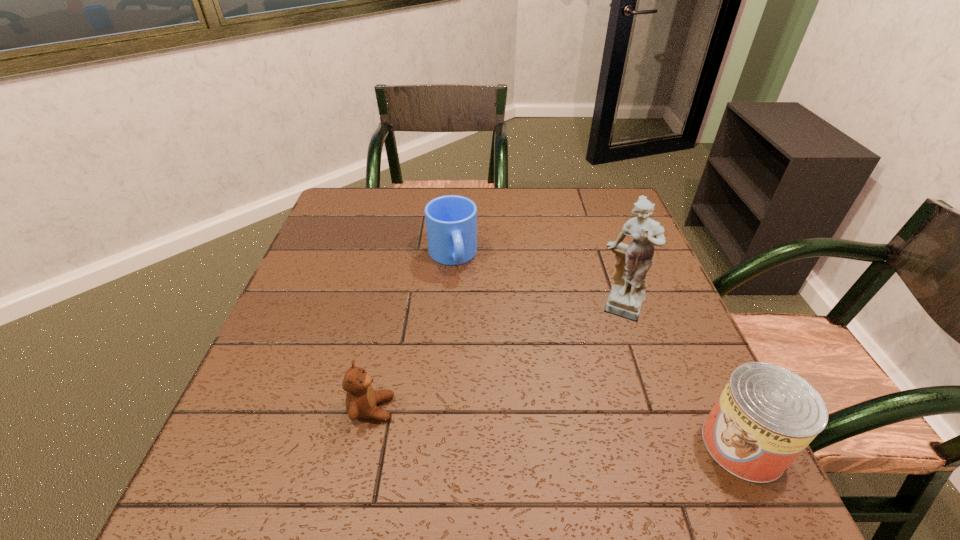
This screenshot has height=540, width=960. I want to click on vacant region located 0.290m on the front-facing side of the third object from left to right, so click(x=598, y=443).

Find the location of a particular element. vacant region located 0.180m on the side of the farthest object with the handle is located at coordinates (474, 329).

Where is `vacant area situated 0.250m on the side of the farthest object with the handle`? Image resolution: width=960 pixels, height=540 pixels. vacant area situated 0.250m on the side of the farthest object with the handle is located at coordinates (482, 353).

Locate an element on the screen. The height and width of the screenshot is (540, 960). vacant position located 0.060m on the side of the farthest object with the handle is located at coordinates (463, 293).

Locate an element on the screen. teddy bear located in the near edge section of the desktop is located at coordinates (361, 399).

The image size is (960, 540). In order to click on can that is at the near edge in this screenshot , I will do `click(766, 415)`.

You are a GUI agent. You are given a task and a screenshot of the screen. Output one action in this format:
    pyautogui.click(x=<x>, y=<y>)
    Task: Click on the can positioned at the right edge
    Image resolution: width=960 pixels, height=540 pixels.
    Given the screenshot: What is the action you would take?
    pyautogui.click(x=766, y=415)

Find the location of a particular element. This screenshot has width=960, height=540. figurine situated at the right edge is located at coordinates coord(633,261).

Where is `object located in the near right corner section of the desktop`? object located in the near right corner section of the desktop is located at coordinates (766, 415).

Where is `vacant space at the far edge of the desktop`? vacant space at the far edge of the desktop is located at coordinates (550, 207).